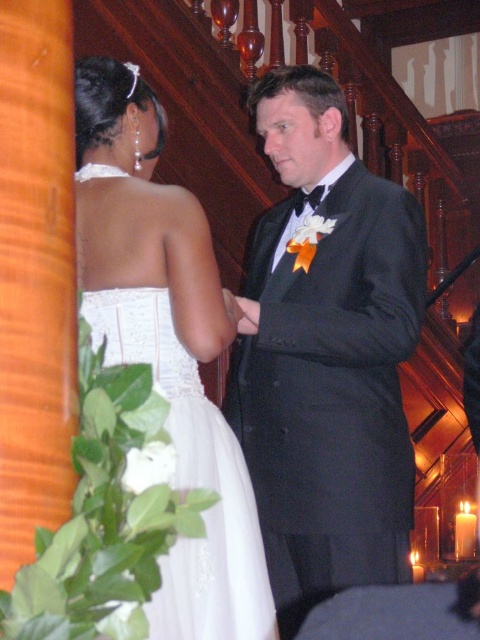
Which of these two, black satin tuxedo at center or white satin dress at center, stands taller?

With more height is black satin tuxedo at center.

Which is more to the left, black satin tuxedo at center or white satin dress at center?

Positioned to the left is white satin dress at center.

Is point (272, 408) behind point (148, 170)?

Yes, point (272, 408) is farther from viewer.

Locate an element on the screen. The height and width of the screenshot is (640, 480). black satin tuxedo at center is located at coordinates (325, 353).